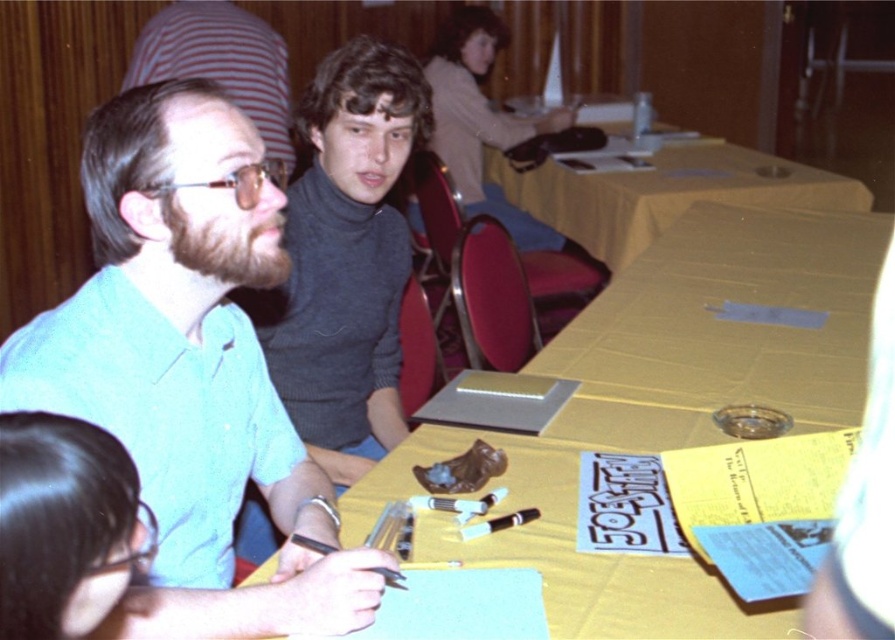
Question: Can you confirm if yellow paper at center is positioned to the left of yellow fabric table at center?

Choices:
 (A) no
 (B) yes

Answer: (B)

Question: Is teal shirt at center positioned in front of matte green shirt at upper left?

Choices:
 (A) no
 (B) yes

Answer: (B)

Question: Which point is closer to the camera?

Choices:
 (A) yellow paper at center
 (B) light beige sweater at upper center
 (C) matte green shirt at upper left
 (D) black hair at lower left

Answer: (D)

Question: Is teal shirt at center positioned at the back of black hair at lower left?

Choices:
 (A) yes
 (B) no

Answer: (A)

Question: Which point is farther from the camera taking this photo?

Choices:
 (A) (830, 196)
 (B) (22, 625)
 (C) (147, 44)
 (D) (433, 131)

Answer: (D)

Question: Which of the following is the closest to the observer?

Choices:
 (A) (198, 340)
 (B) (88, 470)
 (C) (727, 202)

Answer: (B)